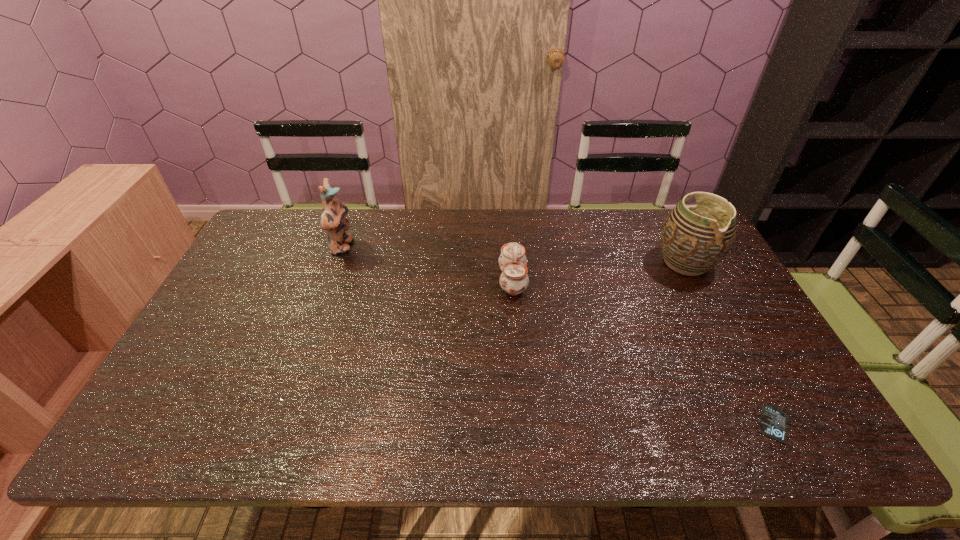
Identify the location of vacant space located by the handle of the second shortest object. This screenshot has height=540, width=960. (445, 281).

The image size is (960, 540). Find the location of `free space located on the left of the identity card`. free space located on the left of the identity card is located at coordinates (683, 424).

The height and width of the screenshot is (540, 960). In order to click on figurine situated at the far edge in this screenshot , I will do `click(333, 220)`.

Where is `pottery at the far edge`? pottery at the far edge is located at coordinates (x=694, y=239).

Identify the location of object that is at the near edge. This screenshot has width=960, height=540. (773, 423).

What are the coordinates of `pottery positioned at the right edge` in the screenshot? It's located at (694, 239).

This screenshot has height=540, width=960. I want to click on identity card that is at the right edge, so click(773, 423).

Image resolution: width=960 pixels, height=540 pixels. Identify the location of object that is positioned at the far right corner. (694, 239).

You are a GUI agent. You are given a task and a screenshot of the screen. Output one action in this format:
    pyautogui.click(x=<x>, y=<y>)
    Task: Click on the object situated at the near right corner
    
    Given the screenshot: What is the action you would take?
    pyautogui.click(x=773, y=423)

Where is `vacant space at the far edge`? Image resolution: width=960 pixels, height=540 pixels. vacant space at the far edge is located at coordinates (502, 227).